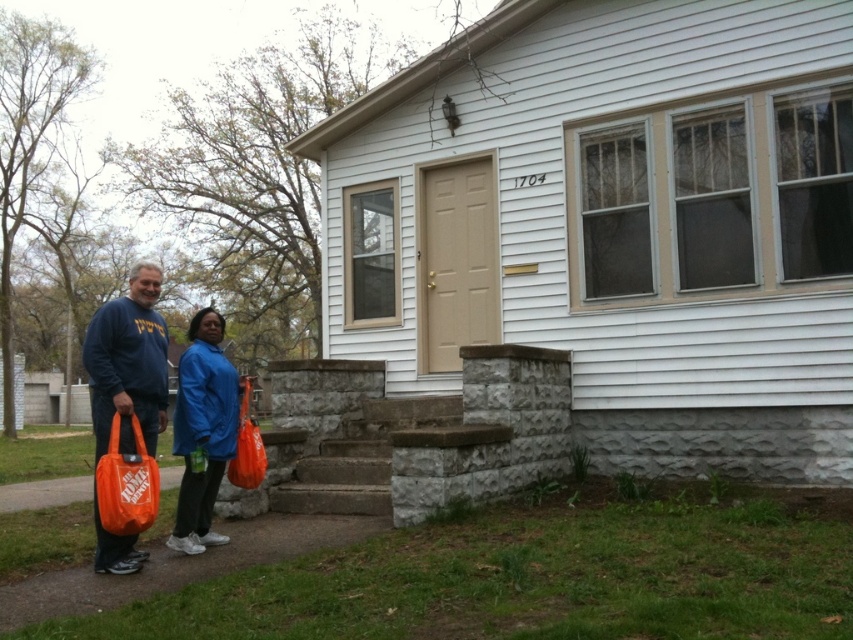
You are a delivery person who needs to hand over a package to the homeowner. The homeowner is standing at the front door. You are currently standing on the concrete steps leading to the door. You see the blue fabric jacket at lower left and the orange plastic bag at lower left. Which item is smaller in size?

The blue fabric jacket at lower left is smaller in size than the orange plastic bag at lower left because it occupies less space.

You are standing at point (100, 499) and want to walk to the front door of the house. Which direction should you move to avoid the person at point (235, 406)?

You should move towards the left because point (235, 406) is behind your current position at (100, 499), so moving left would avoid them.

You are a delivery person trying to hand over a package to the person wearing the matte blue sweatshirt at left. The package is too large to fit in the orange plastic bag at lower left. Where should you place the package so it doesn

The matte blue sweatshirt at left might be wider than the orange plastic bag at lower left, so the package should be placed near the matte blue sweatshirt at left since it has more space compared to the orange plastic bag at lower left.